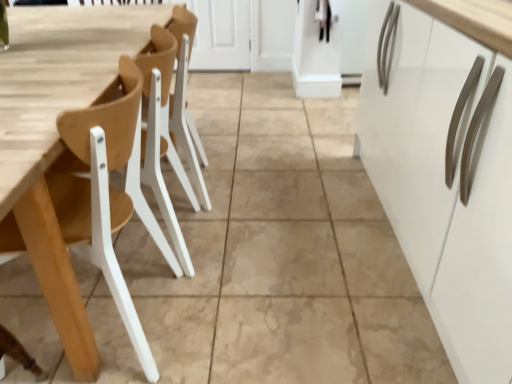
Where is `vacant space to the right of wooden chair at left`? The image size is (512, 384). vacant space to the right of wooden chair at left is located at coordinates (230, 309).